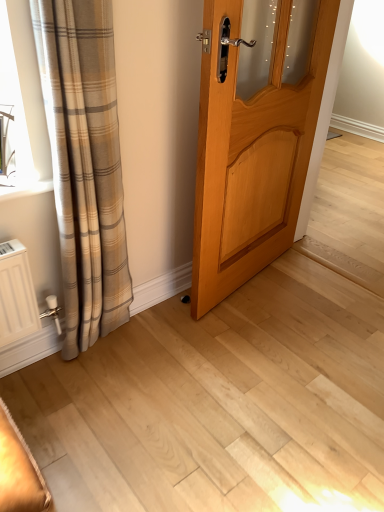
Locate an element on the screen. vacant space underneath plaid fabric curtain at left (from a real-world perspective) is located at coordinates (99, 346).